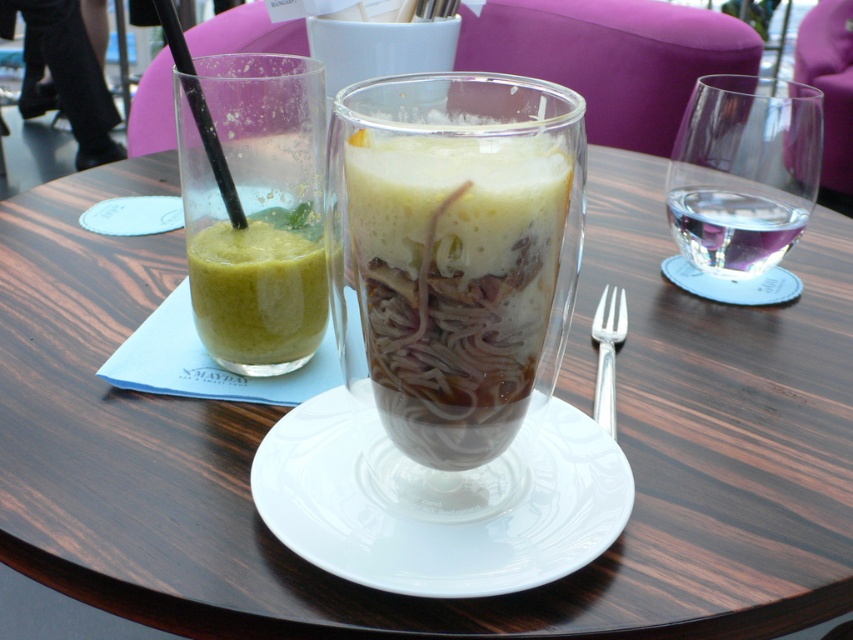
Question: Observing the image, what is the correct spatial positioning of translucent glass cup at center in reference to clear glass water at upper right?

Choices:
 (A) above
 (B) below

Answer: (B)

Question: Which of the following is the closest to the observer?

Choices:
 (A) (776, 209)
 (B) (292, 234)
 (C) (704, 257)

Answer: (B)

Question: Among these points, which one is farthest from the camera?

Choices:
 (A) (599, 388)
 (B) (699, 237)
 (C) (184, 70)
 (D) (735, 83)

Answer: (D)

Question: Does translucent glass cup at center have a greater width compared to transparent plastic straw at upper center?

Choices:
 (A) yes
 (B) no

Answer: (A)

Question: Observing the image, what is the correct spatial positioning of green matte smoothie at left in reference to transparent plastic straw at upper center?

Choices:
 (A) above
 (B) below

Answer: (B)

Question: Which point is farther to the camera?

Choices:
 (A) (669, 211)
 (B) (605, 339)
 (C) (737, 205)

Answer: (A)